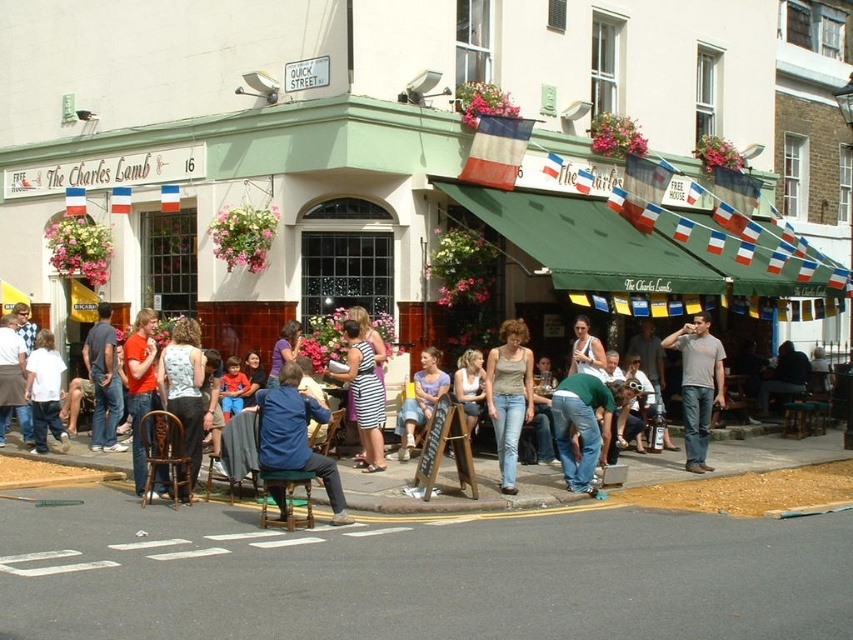
Does gray cotton t-shirt at center appear over striped fabric dress at center?

No.

Who is higher up, gray cotton t-shirt at center or striped fabric dress at center?

Positioned higher is striped fabric dress at center.

The width and height of the screenshot is (853, 640). What do you see at coordinates (698, 385) in the screenshot?
I see `gray cotton t-shirt at center` at bounding box center [698, 385].

I want to click on gray cotton t-shirt at center, so click(698, 385).

Does point (194, 381) come behind point (97, 444)?

That is False.

Is white lace blouse at center below denim jacket at left?

Yes, white lace blouse at center is below denim jacket at left.

Measure the distance between point (202, 429) and camera.

A distance of 32.78 feet exists between point (202, 429) and camera.

This screenshot has width=853, height=640. I want to click on white lace blouse at center, so click(x=184, y=387).

In the scene shown: Who is taller, denim shorts at center or dark blue shirt at center?

Standing taller between the two is denim shorts at center.

How far apart are denim shorts at center and dark blue shirt at center?

A distance of 7.51 meters exists between denim shorts at center and dark blue shirt at center.

Describe the element at coordinates (421, 401) in the screenshot. This screenshot has height=640, width=853. I see `denim shorts at center` at that location.

Find the location of a particular element. Image resolution: width=853 pixels, height=640 pixels. denim shorts at center is located at coordinates (421, 401).